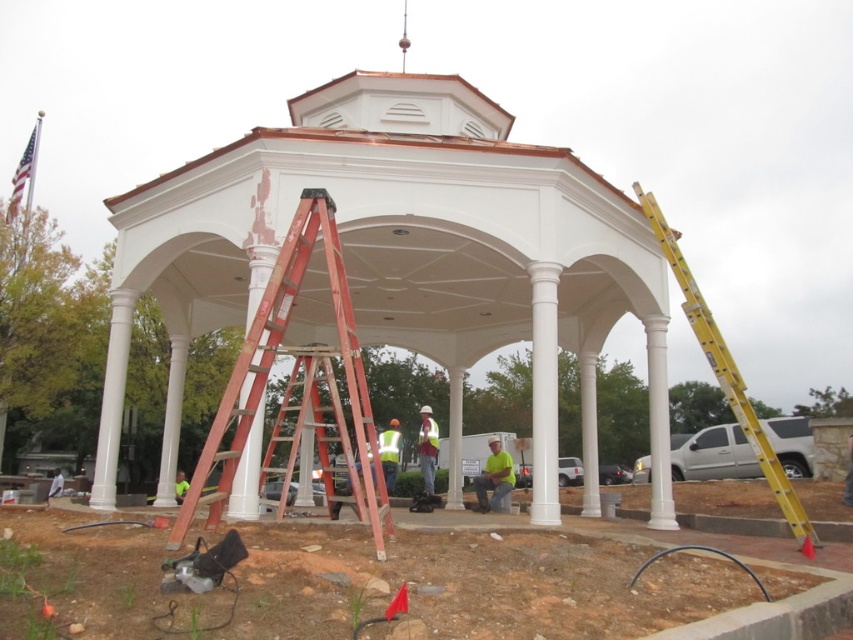
Question: Which object is farther from the camera taking this photo?

Choices:
 (A) reflective silver helmet at center
 (B) red painted wood ladder at center
 (C) yellow metallic ladder at right

Answer: (A)

Question: Can you confirm if yellow metallic ladder at right is smaller than reflective silver helmet at center?

Choices:
 (A) no
 (B) yes

Answer: (A)

Question: In this image, where is dirt at lower center located relative to yellow metallic ladder at right?

Choices:
 (A) above
 (B) below

Answer: (B)

Question: Estimate the real-world distances between objects in this image. Which object is farther from the yellow metallic ladder at right?

Choices:
 (A) reflective silver helmet at center
 (B) green fabric shirt at center
 (C) reflective yellow safety vest at center
 (D) dirt at lower center

Answer: (A)

Question: Which object is the farthest from the yellow metallic ladder at right?

Choices:
 (A) reflective yellow safety vest at center
 (B) dirt at lower center
 (C) reflective silver helmet at center

Answer: (C)

Question: Can you confirm if dirt at lower center is positioned above green fabric shirt at center?

Choices:
 (A) yes
 (B) no

Answer: (A)